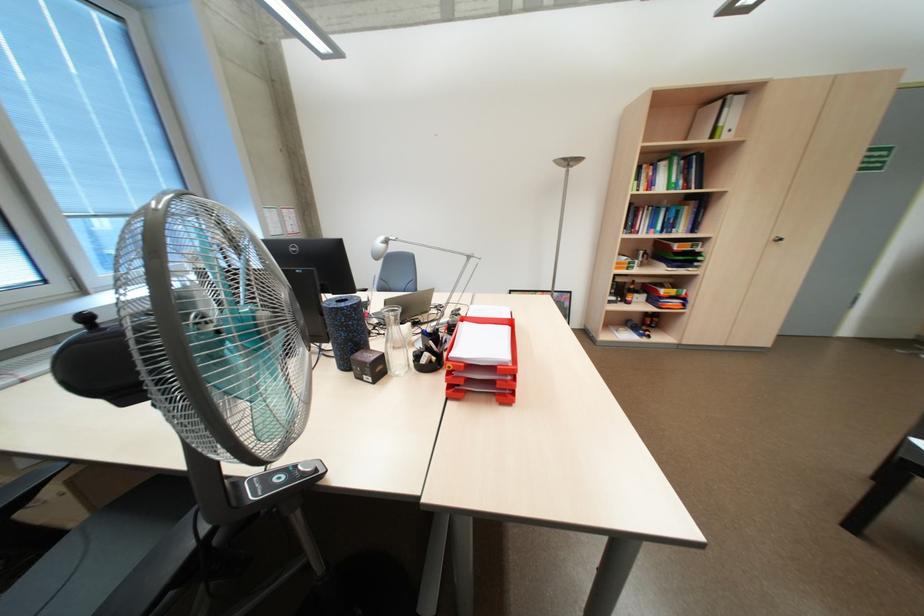
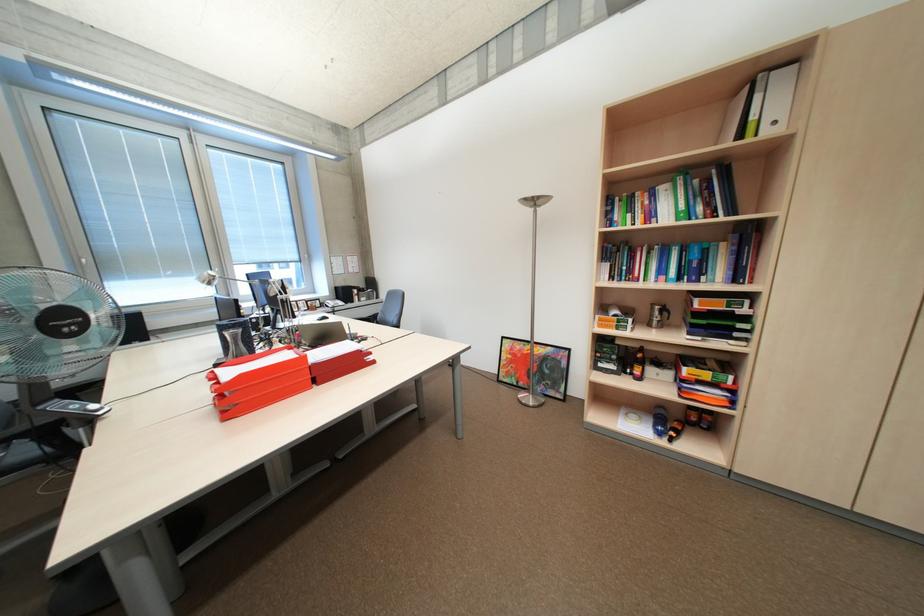
The point at (723, 135) is marked in the first image. Where is the corresponding point in the second image?

(749, 136)